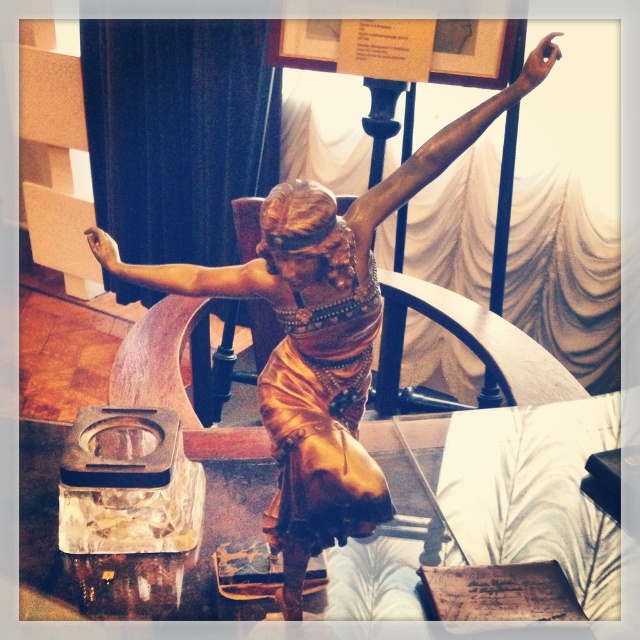
You are a photographer standing at the camera position. The gold shiny statue at center is your subject. To ensure the statue is in focus, you need to set the camera focus distance. What should the focus distance be set to?

The focus distance should be set to 1.24 meters because the gold shiny statue at center and the camera are 1.24 meters apart from each other.

You are standing in front of the bronze sculpture of a dancer on the reflective surface. You notice two points marked in the scene. Which of the two points, point (x=371, y=321) or point (x=461, y=138), is closer to you?

Point (x=371, y=321) is further to the camera than point (x=461, y=138), so the point closer to you is point (x=461, y=138).

You are a photographer trying to capture the bronze sculpture. The bronze arm at upper center is your main focus. If your camera has a minimum focusing distance of 3 feet, will you be able to take a clear photo without moving the sculpture?

The distance between the bronze arm at upper center and the camera is 4.23 feet, which is greater than the camera minimum focusing distance of 3 feet. Therefore, you can take a clear photo without moving the sculpture.